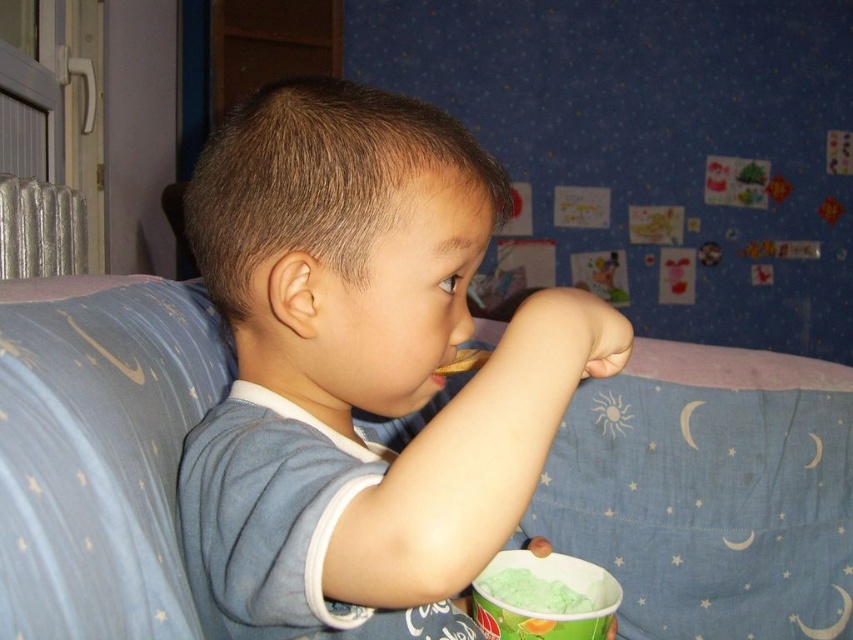
The child is holding a spoon and eating from the green matte ice cream at lower center and the brown crumbly cookie at lower center. Which one is taller?

The green matte ice cream at lower center is much taller than the brown crumbly cookie at lower center.

From the picture: You are a parent trying to clean up after your child. You need to place the brown crumbly cookie at lower center into a trash bin located near the blue fabric bed at center. Can you fit the cookie into the trash bin without moving the bed?

The blue fabric bed at center might be wider than brown crumbly cookie at lower center, so there is a possibility that the trash bin near the bed has enough space to accommodate the cookie. However, since the exact dimensions of the trash bin are not provided, it is recommended to check the available space before placing the cookie.